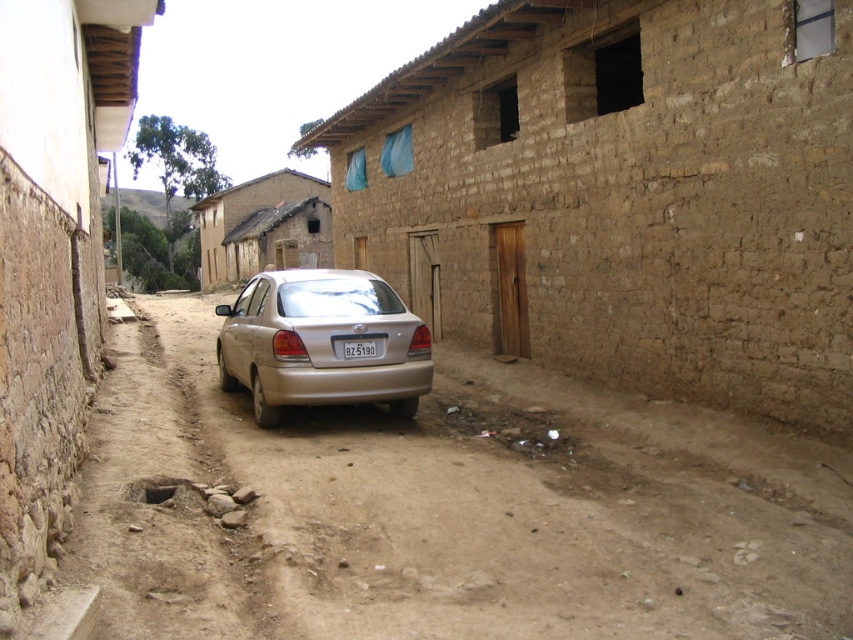
Who is lower down, brown dirt track at center or gold metallic car at center?

brown dirt track at center is lower down.

Which is above, brown dirt track at center or gold metallic car at center?

gold metallic car at center

Which is behind, point (177, 444) or point (368, 364)?

Point (368, 364)

Locate an element on the screen. The width and height of the screenshot is (853, 640). brown dirt track at center is located at coordinates (450, 509).

Consider the image. Can you confirm if brown dirt track at center is smaller than white plastic license plate at center?

No.

Locate an element on the screen. The width and height of the screenshot is (853, 640). brown dirt track at center is located at coordinates (450, 509).

Identify the location of brown dirt track at center. (450, 509).

Who is taller, gold metallic car at center or white plastic license plate at center?

gold metallic car at center is taller.

Which is in front, point (426, 378) or point (373, 356)?

Point (373, 356) is in front.

At what (x,y) coordinates should I click in order to perform the action: click on gold metallic car at center. Please return your answer as a coordinate pair (x, y). The height and width of the screenshot is (640, 853). Looking at the image, I should click on (321, 342).

In order to click on gold metallic car at center in this screenshot , I will do `click(321, 342)`.